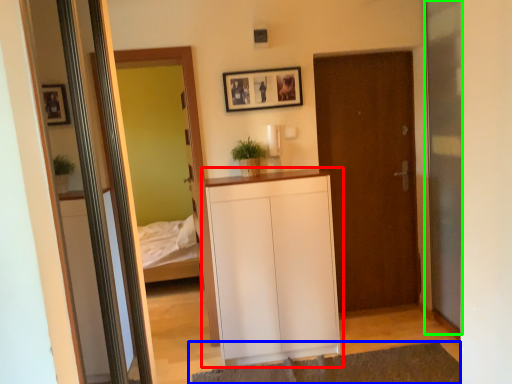
Question: Which object is the closest to the cabinetry (highlighted by a red box)? Choose among these: plain (highlighted by a blue box) or screen door (highlighted by a green box).

Choices:
 (A) plain
 (B) screen door

Answer: (A)